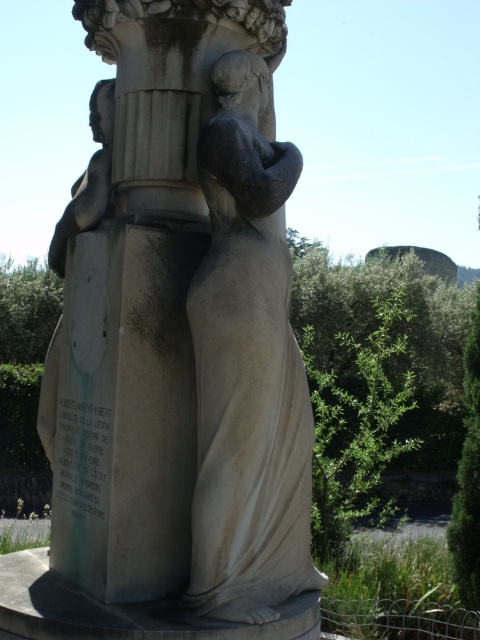
In the scene shown: You are an art student analyzing the composition of the sculpture arrangement. Which object is positioned to the right of the other between the white marble statue at center and the matte stone bust at upper left?

The white marble statue at center is positioned to the right of the matte stone bust at upper left.